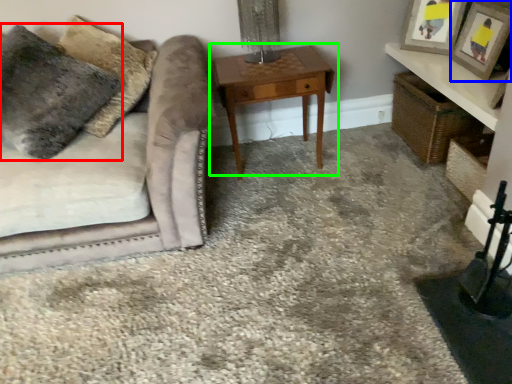
Question: Which is farther away from pillow (highlighted by a red box)? picture frame (highlighted by a blue box) or table (highlighted by a green box)?

Choices:
 (A) picture frame
 (B) table

Answer: (A)